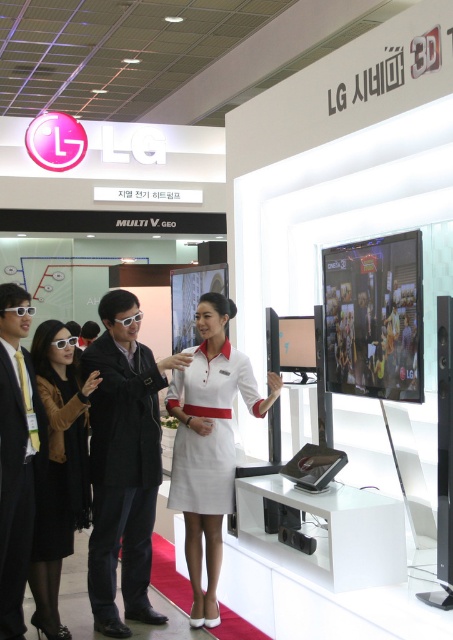
Is white fabric dress at center to the left of black fabric dress at center from the viewer's perspective?

In fact, white fabric dress at center is to the right of black fabric dress at center.

Is point (223, 326) positioned behind point (58, 376)?

Yes, it is.

Describe the element at coordinates (208, 444) in the screenshot. I see `white fabric dress at center` at that location.

Find the location of a particular element. white fabric dress at center is located at coordinates (208, 444).

Does black matte suit at center appear on the left side of black fabric dress at center?

Incorrect, black matte suit at center is not on the left side of black fabric dress at center.

Does black matte suit at center have a larger size compared to black fabric dress at center?

Indeed, black matte suit at center has a larger size compared to black fabric dress at center.

This screenshot has height=640, width=453. What are the coordinates of `black matte suit at center` in the screenshot? It's located at (124, 461).

Is black fabric dress at center further to camera compared to white glossy sunglasses at left?

Yes, it is behind white glossy sunglasses at left.

Is black fabric dress at center below white glossy sunglasses at left?

Yes.

Is point (46, 509) positioned in front of point (28, 444)?

No, (46, 509) is behind (28, 444).

Where is `black fabric dress at center`? This screenshot has width=453, height=640. black fabric dress at center is located at coordinates (59, 468).